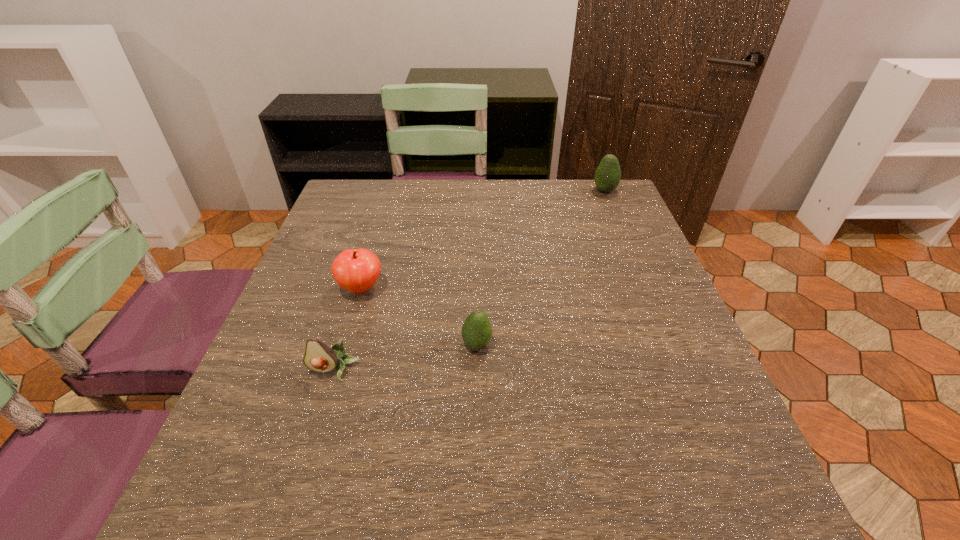
The height and width of the screenshot is (540, 960). Identify the location of free space located 0.270m on the left of the second farthest avocado. (325, 345).

Find the location of a particular element. This screenshot has width=960, height=540. object that is at the far edge is located at coordinates (607, 177).

Where is `apple that is at the left edge`? The image size is (960, 540). apple that is at the left edge is located at coordinates (356, 270).

You are a GUI agent. You are given a task and a screenshot of the screen. Output one action in this format:
    pyautogui.click(x=<x>, y=<y>)
    Task: Click on the avocado that is at the left edge
    
    Given the screenshot: What is the action you would take?
    pyautogui.click(x=319, y=357)

At what (x,y) coordinates should I click in order to perform the action: click on object located in the right edge section of the desktop. Please return your answer as a coordinate pair (x, y). The width and height of the screenshot is (960, 540). Looking at the image, I should click on (607, 177).

Where is `object positioned at the far right corner`? object positioned at the far right corner is located at coordinates (607, 177).

I want to click on vacant space at the far edge of the desktop, so click(x=474, y=221).

This screenshot has width=960, height=540. In the image, there is a desktop. In order to click on vacant space at the near edge in this screenshot , I will do `click(643, 479)`.

Identify the location of vacant space at the left edge. Image resolution: width=960 pixels, height=540 pixels. (365, 241).

Find the location of a particular element. This screenshot has height=540, width=960. vacant space at the right edge is located at coordinates (648, 418).